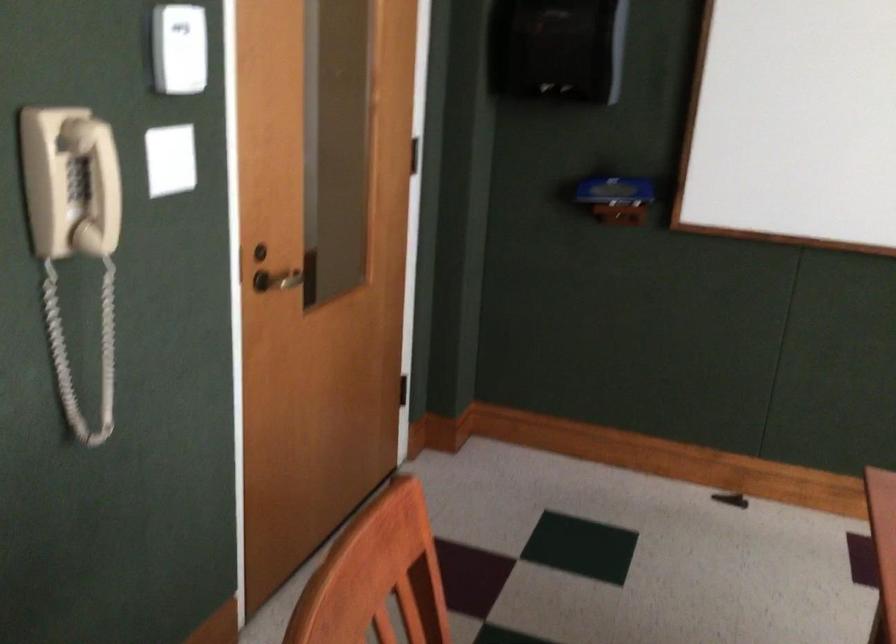
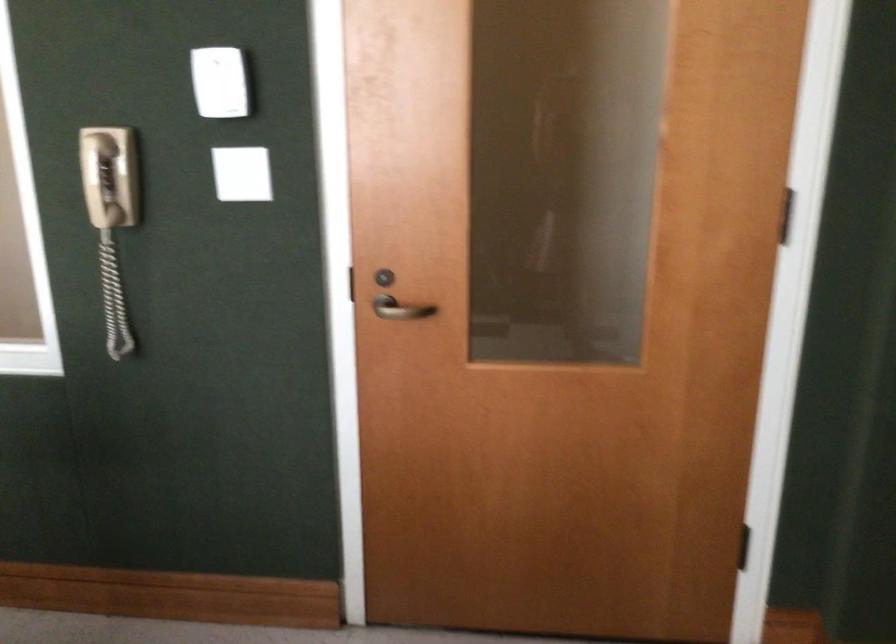
Find the pixel in the second image that matches (x=286, y=279) in the first image.

(401, 308)